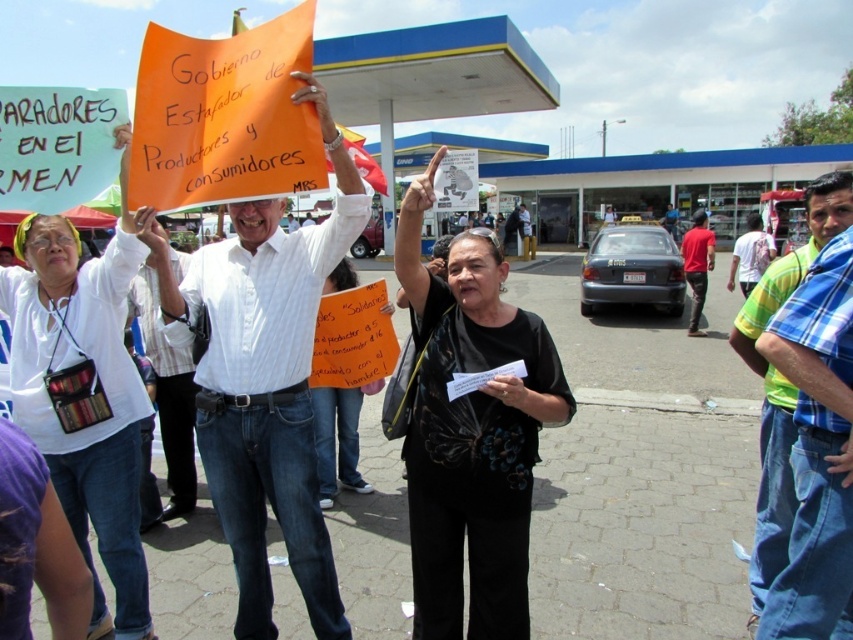
Who is positioned more to the right, red cotton shirt at right or dark blue jeans at right?

dark blue jeans at right is more to the right.

Is red cotton shirt at right further to camera compared to dark blue jeans at right?

Yes.

Who is more distant from viewer, (692, 330) or (741, 284)?

The point (692, 330) is behind.

This screenshot has height=640, width=853. Identify the location of red cotton shirt at right. (697, 264).

Is white shirt at center to the right of blue plaid shirt at right from the viewer's perspective?

Incorrect, white shirt at center is not on the right side of blue plaid shirt at right.

Is white shirt at center in front of blue plaid shirt at right?

No, it is behind blue plaid shirt at right.

Does point (231, 336) come in front of point (750, 593)?

Yes, it is.

Locate an element on the screen. This screenshot has width=853, height=640. white shirt at center is located at coordinates (265, 380).

Is blue plaid shirt at right closer to camera compared to dark blue jeans at right?

Yes.

Between point (788, 467) and point (762, 264), which one is positioned in front?

Positioned in front is point (788, 467).

At what (x,y) coordinates should I click in order to perform the action: click on blue plaid shirt at right. Please return your answer as a coordinate pair (x, y). Looking at the image, I should click on (782, 378).

This screenshot has height=640, width=853. Identify the location of blue plaid shirt at right. (782, 378).